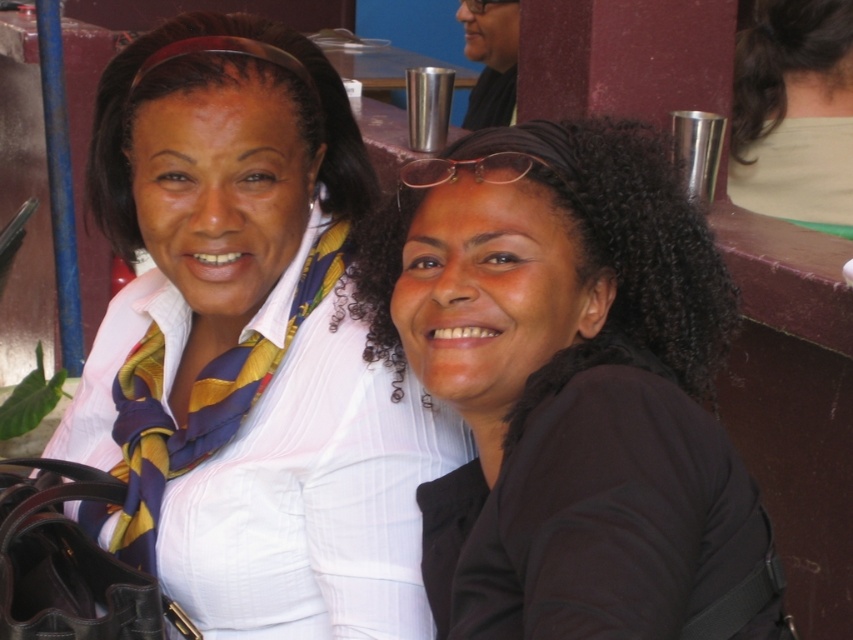
Which of these two, white striped shirt at center or black matte hair at center, stands taller?

With more height is white striped shirt at center.

This screenshot has width=853, height=640. Describe the element at coordinates (248, 346) in the screenshot. I see `white striped shirt at center` at that location.

Does point (134, 560) come farther from viewer compared to point (699, 433)?

That is True.

Identify the location of white striped shirt at center. (248, 346).

Is white striped shirt at center behind light beige fabric at upper right?

No.

Who is more forward, (311, 611) or (822, 115)?

Point (311, 611) is in front.

What do you see at coordinates (248, 346) in the screenshot? I see `white striped shirt at center` at bounding box center [248, 346].

At what (x,y) coordinates should I click in order to perform the action: click on white striped shirt at center. Please return your answer as a coordinate pair (x, y). This screenshot has width=853, height=640. Looking at the image, I should click on (248, 346).

Measure the distance from black matte hair at center to light beige fabric at upper right.

black matte hair at center and light beige fabric at upper right are 2.02 meters apart from each other.

The image size is (853, 640). What do you see at coordinates (570, 388) in the screenshot?
I see `black matte hair at center` at bounding box center [570, 388].

Where is `black matte hair at center`? The width and height of the screenshot is (853, 640). black matte hair at center is located at coordinates (570, 388).